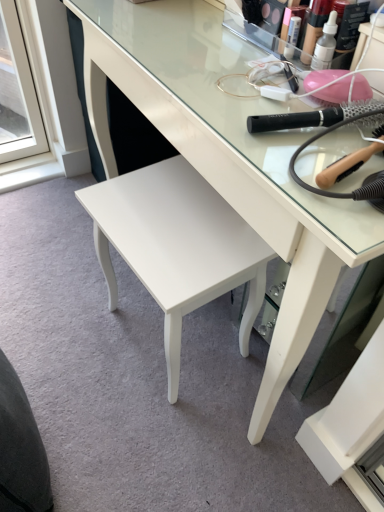
Image resolution: width=384 pixels, height=512 pixels. I want to click on vacant area that lies between black plastic hairbrush at upper right, which is counted as the first brush, starting from the top, and wooden-handled hairbrush at upper right, marked as the 2th brush in a top-to-bottom arrangement, so click(x=306, y=148).